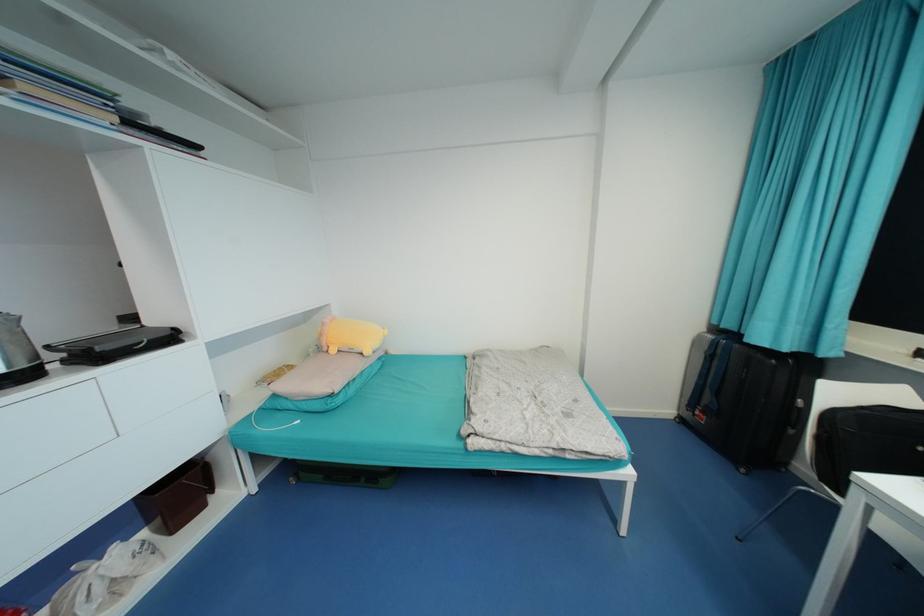
The image size is (924, 616). What are the coordinates of `brown trash bin` in the screenshot? It's located at (176, 496).